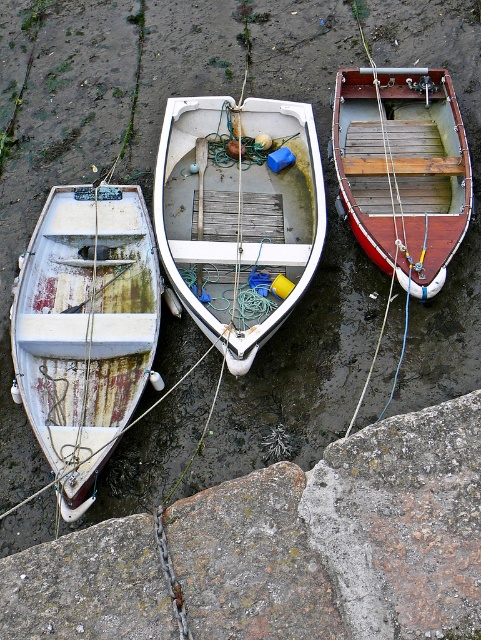
Is point (32, 340) in front of point (242, 326)?

That is True.

Who is higher up, rusty metal boat at left or white matte wooden boat at center?

white matte wooden boat at center

Which is in front, point (42, 320) or point (264, 266)?

Point (42, 320) is in front.

Locate an element on the screen. This screenshot has width=481, height=640. rusty metal boat at left is located at coordinates (85, 328).

What do you see at coordinates (238, 216) in the screenshot? I see `white matte wooden boat at center` at bounding box center [238, 216].

You are a GUI agent. You are given a task and a screenshot of the screen. Output one action in this format:
    pyautogui.click(x=<x>, y=<y>)
    Task: Click on the white matte wooden boat at center
    Image resolution: width=481 pixels, height=640 pixels.
    Given the screenshot: What is the action you would take?
    pyautogui.click(x=238, y=216)

The height and width of the screenshot is (640, 481). I want to click on white matte wooden boat at center, so click(238, 216).

Does rusty concrete stone at lower left have a greater height compared to rusty metal boat at left?

In fact, rusty concrete stone at lower left may be shorter than rusty metal boat at left.

At what (x,y) coordinates should I click in order to perform the action: click on rusty concrete stone at lower left. Please return your answer as a coordinate pair (x, y). This screenshot has width=481, height=640. Looking at the image, I should click on (342, 538).

The image size is (481, 640). I want to click on rusty concrete stone at lower left, so click(x=342, y=538).